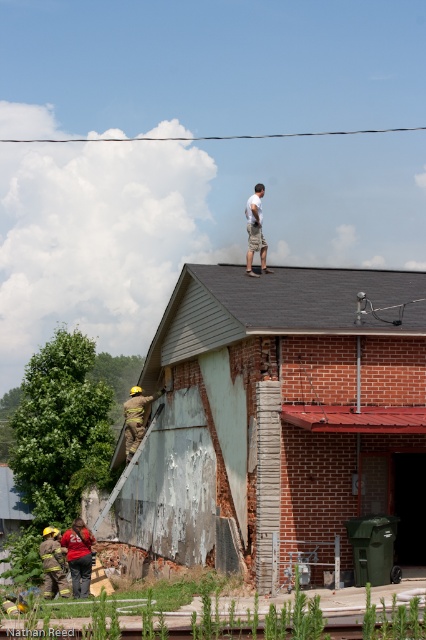
Is peeling paint wall at lower left further to the viewer compared to gray shingles at upper center?

No, it is in front of gray shingles at upper center.

Consider the image. Does peeling paint wall at lower left have a lesser height compared to gray shingles at upper center?

In fact, peeling paint wall at lower left may be taller than gray shingles at upper center.

Is point (396, 273) behind point (278, 323)?

Yes, it is.

What are the coordinates of `peeling paint wall at lower left` in the screenshot? It's located at (282, 417).

Which is more to the left, brushed metal helmet at lower left or white cotton shirt at upper center?

From the viewer's perspective, brushed metal helmet at lower left appears more on the left side.

This screenshot has width=426, height=640. What do you see at coordinates (51, 564) in the screenshot?
I see `brushed metal helmet at lower left` at bounding box center [51, 564].

The image size is (426, 640). Find the location of `brushed metal helmet at lower left`. brushed metal helmet at lower left is located at coordinates point(51,564).

Is point (350, 291) positioned before point (54, 561)?

Yes, it is.

Between gray shingles at upper center and brushed metal helmet at lower left, which one has more height?

gray shingles at upper center

Who is more distant from viewer, (316, 304) or (45, 557)?

The point (45, 557) is more distant.

The width and height of the screenshot is (426, 640). I want to click on gray shingles at upper center, so click(279, 307).